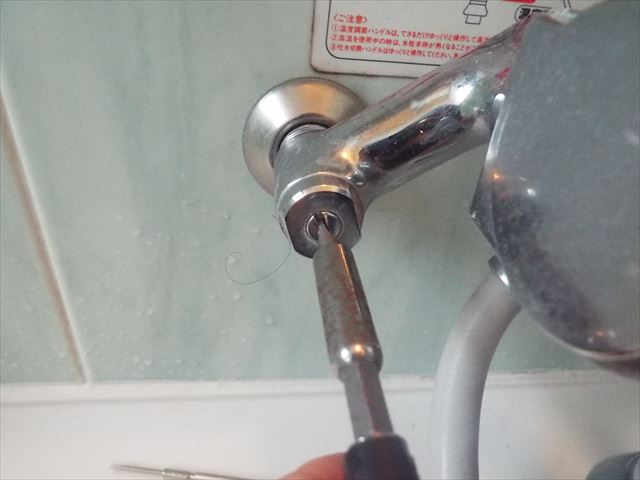
Locate an element on the screen. This screenshot has height=480, width=640. metal wall cover is located at coordinates [x=282, y=100].